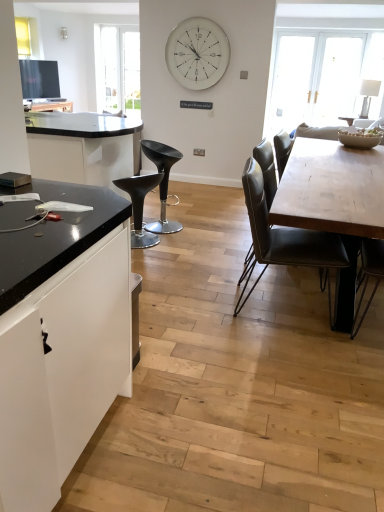
Question: Is the position of black plastic stool at center, the second chair viewed from the left, more distant than that of wooden table at center?

Choices:
 (A) yes
 (B) no

Answer: (A)

Question: Can you confirm if black plastic stool at center, which appears as the third chair when viewed from the front, is positioned to the right of wooden table at center?

Choices:
 (A) no
 (B) yes

Answer: (A)

Question: From a real-world perspective, is black plastic stool at center, the second chair viewed from the left, beneath wooden table at center?

Choices:
 (A) no
 (B) yes

Answer: (B)

Question: Considering the relative positions of black plastic stool at center, marked as the 1th chair in a back-to-front arrangement, and wooden table at center in the image provided, is black plastic stool at center, marked as the 1th chair in a back-to-front arrangement, to the left of wooden table at center from the viewer's perspective?

Choices:
 (A) yes
 (B) no

Answer: (A)

Question: From the image's perspective, is black plastic stool at center, marked as the 1th chair in a back-to-front arrangement, located above wooden table at center?

Choices:
 (A) no
 (B) yes

Answer: (B)

Question: Which is correct: white glossy clock at upper center is inside matte black stool at center, the 2th chair positioned from the front, or outside of it?

Choices:
 (A) inside
 (B) outside

Answer: (B)

Question: From the image's perspective, relative to matte black stool at center, the 2th chair positioned from the front, is white glossy clock at upper center above or below?

Choices:
 (A) below
 (B) above

Answer: (B)

Question: Would you say white glossy clock at upper center is to the left or to the right of matte black stool at center, placed as the third chair when sorted from right to left, in the picture?

Choices:
 (A) left
 (B) right

Answer: (B)

Question: From a real-world perspective, is white glossy clock at upper center physically located above or below matte black stool at center, placed as the third chair when sorted from right to left?

Choices:
 (A) below
 (B) above

Answer: (B)

Question: Considering the positions of matte black stool at center, the 2th chair positioned from the front, and wooden table at center in the image, is matte black stool at center, the 2th chair positioned from the front, wider or thinner than wooden table at center?

Choices:
 (A) thin
 (B) wide

Answer: (A)

Question: In terms of height, does matte black stool at center, marked as the 1th chair in a left-to-right arrangement, look taller or shorter compared to wooden table at center?

Choices:
 (A) tall
 (B) short

Answer: (B)

Question: Is point (147, 179) closer or farther from the camera than point (342, 233)?

Choices:
 (A) closer
 (B) farther

Answer: (B)

Question: In the image, is matte black stool at center, the 2th chair positioned from the front, positioned in front of or behind wooden table at center?

Choices:
 (A) front
 (B) behind

Answer: (B)

Question: Is leather-like black chair at center, marked as the first chair in a right-to-left arrangement, to the left or to the right of white glossy clock at upper center in the image?

Choices:
 (A) left
 (B) right

Answer: (B)

Question: Is leather-like black chair at center, the 3th chair when ordered from back to front, wider or thinner than white glossy clock at upper center?

Choices:
 (A) wide
 (B) thin

Answer: (A)